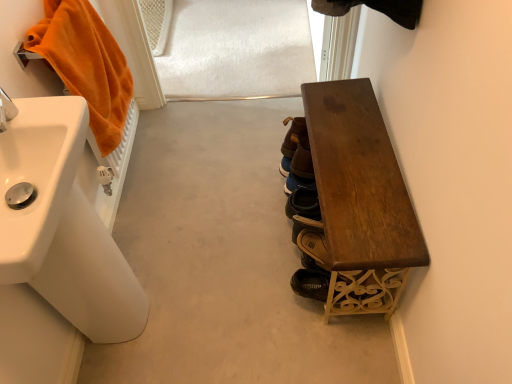
Identify the location of free region under orange plush towel at left (from a real-world perspective). The width and height of the screenshot is (512, 384). click(x=141, y=170).